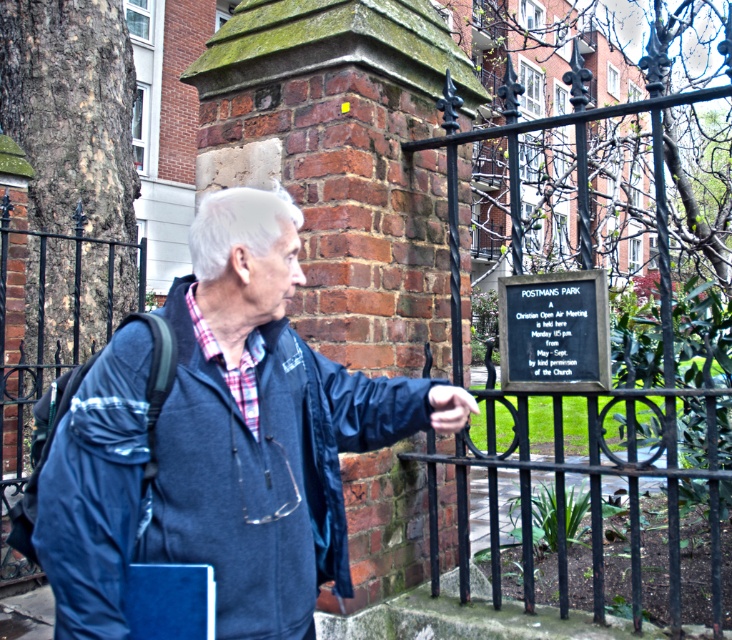
Is blue fleece jacket at lower left taller than black polished stone plaque at center?

Yes, blue fleece jacket at lower left is taller than black polished stone plaque at center.

Between blue fleece jacket at lower left and black polished stone plaque at center, which one has more height?

Standing taller between the two is blue fleece jacket at lower left.

Which is behind, point (302, 452) or point (526, 305)?

The point (526, 305) is behind.

Image resolution: width=732 pixels, height=640 pixels. What are the coordinates of `blue fleece jacket at lower left` in the screenshot? It's located at (266, 472).

Does black wrought iron fence at center appear over black polished stone plaque at center?

Yes, black wrought iron fence at center is above black polished stone plaque at center.

Which is in front, point (459, 134) or point (582, 292)?

Point (582, 292)

Is point (597, 113) less distant than point (507, 304)?

That is True.

Identify the location of black wrought iron fence at center. The width and height of the screenshot is (732, 640). (589, 218).

Does black metal fence at left appear under black polished stone plaque at center?

Incorrect, black metal fence at left is not positioned below black polished stone plaque at center.

Is the position of black metal fence at left more distant than that of black polished stone plaque at center?

Yes, it is.

This screenshot has height=640, width=732. Describe the element at coordinates (51, 337) in the screenshot. I see `black metal fence at left` at that location.

Find the location of `black metal fence at left`. black metal fence at left is located at coordinates (51, 337).